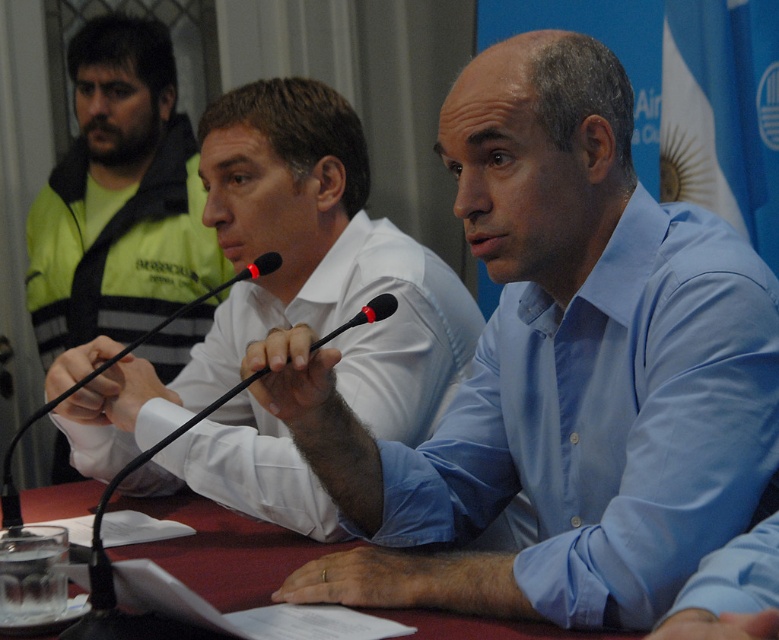
Question: Can you confirm if white shirt at center is positioned to the left of maroon fabric table at center?

Choices:
 (A) yes
 (B) no

Answer: (B)

Question: Can you confirm if white shirt at center is positioned above maroon fabric table at center?

Choices:
 (A) yes
 (B) no

Answer: (A)

Question: Observing the image, what is the correct spatial positioning of yellow reflective vest at left in reference to maroon fabric table at center?

Choices:
 (A) above
 (B) below

Answer: (A)

Question: Which object appears farthest from the camera in this image?

Choices:
 (A) black plastic microphone at center
 (B) white shirt at center
 (C) yellow reflective vest at left

Answer: (C)

Question: Among these points, which one is farthest from the camera?

Choices:
 (A) (65, 456)
 (B) (203, 576)

Answer: (A)

Question: Which point is closer to the camera?

Choices:
 (A) (330, 244)
 (B) (199, 556)
 (C) (496, 326)

Answer: (B)